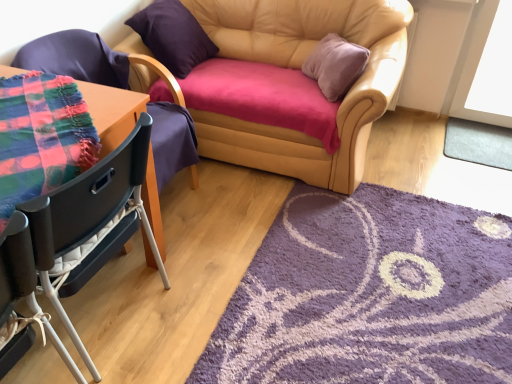
Question: Are leather couch at center and black plastic chair at left, arranged as the 2th chair when viewed from the front, far apart?

Choices:
 (A) no
 (B) yes

Answer: (B)

Question: Is leather couch at center touching black plastic chair at left, arranged as the 2th chair when viewed from the front?

Choices:
 (A) yes
 (B) no

Answer: (B)

Question: Considering the relative positions of leather couch at center and black plastic chair at left, placed as the second chair when sorted from back to front, in the image provided, is leather couch at center to the left of black plastic chair at left, placed as the second chair when sorted from back to front, from the viewer's perspective?

Choices:
 (A) yes
 (B) no

Answer: (B)

Question: Does leather couch at center have a lesser height compared to black plastic chair at left, arranged as the 2th chair when viewed from the front?

Choices:
 (A) no
 (B) yes

Answer: (A)

Question: Is leather couch at center facing away from black plastic chair at left, arranged as the 2th chair when viewed from the front?

Choices:
 (A) no
 (B) yes

Answer: (A)

Question: Does point (449, 127) appear closer or farther from the camera than point (153, 44)?

Choices:
 (A) closer
 (B) farther

Answer: (B)

Question: Is gray soft mat at lower right, placed as the first mat when sorted from right to left, inside the boundaries of purple suede pillow at upper left, or outside?

Choices:
 (A) inside
 (B) outside

Answer: (B)

Question: From their relative heights in the image, would you say gray soft mat at lower right, the 2th mat positioned from the bottom, is taller or shorter than purple suede pillow at upper left?

Choices:
 (A) tall
 (B) short

Answer: (B)

Question: In the image, is gray soft mat at lower right, the first mat viewed from the back, positioned in front of or behind purple suede pillow at upper left?

Choices:
 (A) behind
 (B) front

Answer: (A)

Question: Is gray soft mat at lower right, the first mat viewed from the back, spatially inside purple shaggy rug at lower right, marked as the first mat in a front-to-back arrangement, or outside of it?

Choices:
 (A) inside
 (B) outside

Answer: (B)

Question: Considering the positions of gray soft mat at lower right, which ranks as the second mat in left-to-right order, and purple shaggy rug at lower right, arranged as the first mat when viewed from the left, in the image, is gray soft mat at lower right, which ranks as the second mat in left-to-right order, taller or shorter than purple shaggy rug at lower right, arranged as the first mat when viewed from the left,?

Choices:
 (A) short
 (B) tall

Answer: (A)

Question: From a real-world perspective, relative to purple shaggy rug at lower right, marked as the first mat in a front-to-back arrangement, is gray soft mat at lower right, the first mat viewed from the back, vertically above or below?

Choices:
 (A) above
 (B) below

Answer: (A)

Question: In the image, is gray soft mat at lower right, the 2th mat positioned from the bottom, positioned in front of or behind purple shaggy rug at lower right, marked as the first mat in a front-to-back arrangement?

Choices:
 (A) behind
 (B) front

Answer: (A)

Question: Is gray soft mat at lower right, the 2th mat positioned from the bottom, wider or thinner than black plastic chair at left, arranged as the 2th chair when viewed from the front?

Choices:
 (A) thin
 (B) wide

Answer: (A)

Question: Considering the positions of point (494, 142) and point (144, 155), is point (494, 142) closer or farther from the camera than point (144, 155)?

Choices:
 (A) closer
 (B) farther

Answer: (B)